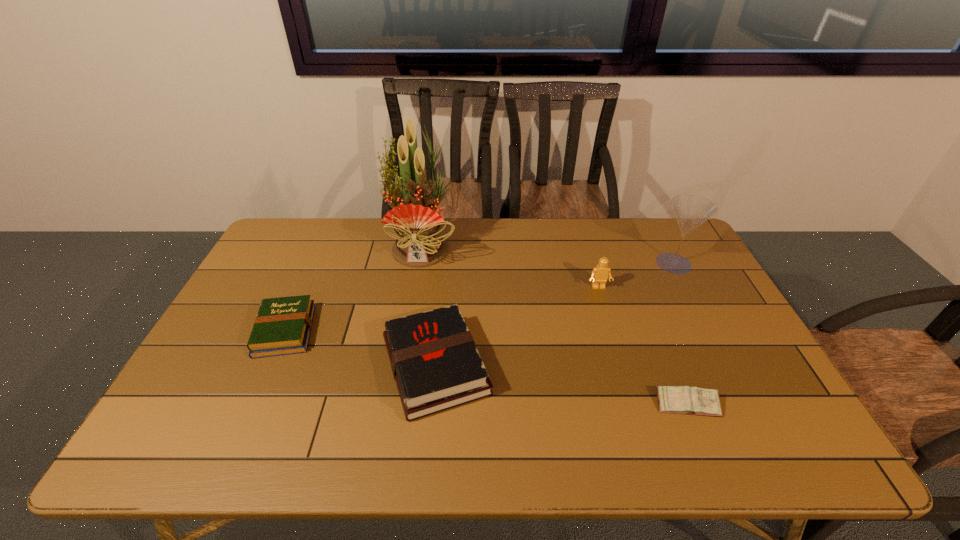
Locate an element on the screen. vacant space positioned on the face of the Lego is located at coordinates (631, 395).

You are a GUI agent. You are given a task and a screenshot of the screen. Output one action in this format:
    pyautogui.click(x=<x>, y=<y>)
    Task: Click on the vacant space located on the right of the third shortest object
    Image resolution: width=960 pixels, height=540 pixels.
    Given the screenshot: What is the action you would take?
    [612, 366]

Find the location of `vacant space located 0.180m on the front of the book`. vacant space located 0.180m on the front of the book is located at coordinates (245, 421).

Locate an element on the screen. The image size is (960, 540). vacant space located on the left of the diary is located at coordinates (631, 404).

Find the location of a particular element. The width and height of the screenshot is (960, 540). flower arrangement that is positioned at the far edge is located at coordinates (419, 243).

I want to click on flute glass that is at the far edge, so click(x=691, y=211).

The width and height of the screenshot is (960, 540). What are the coordinates of `object that is at the left edge` in the screenshot? It's located at (283, 325).

Find the location of a particular element. The image size is (960, 540). flute glass that is at the right edge is located at coordinates (691, 211).

Image resolution: width=960 pixels, height=540 pixels. What are the coordinates of `diary at the right edge` in the screenshot? It's located at (688, 400).

You are a GUI agent. You are given a task and a screenshot of the screen. Output one action in this format:
    pyautogui.click(x=<x>, y=<y>)
    Task: Click on the object that is at the far right corner
    
    Given the screenshot: What is the action you would take?
    pyautogui.click(x=691, y=211)